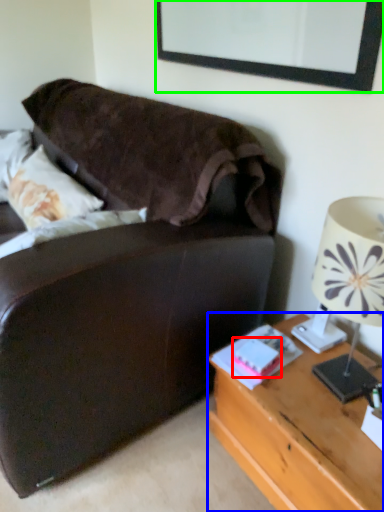
Question: Based on their relative distances, which object is nearer to book (highlighted by a red box)? Choose from desk (highlighted by a blue box) and picture frame (highlighted by a green box).

Choices:
 (A) desk
 (B) picture frame

Answer: (A)